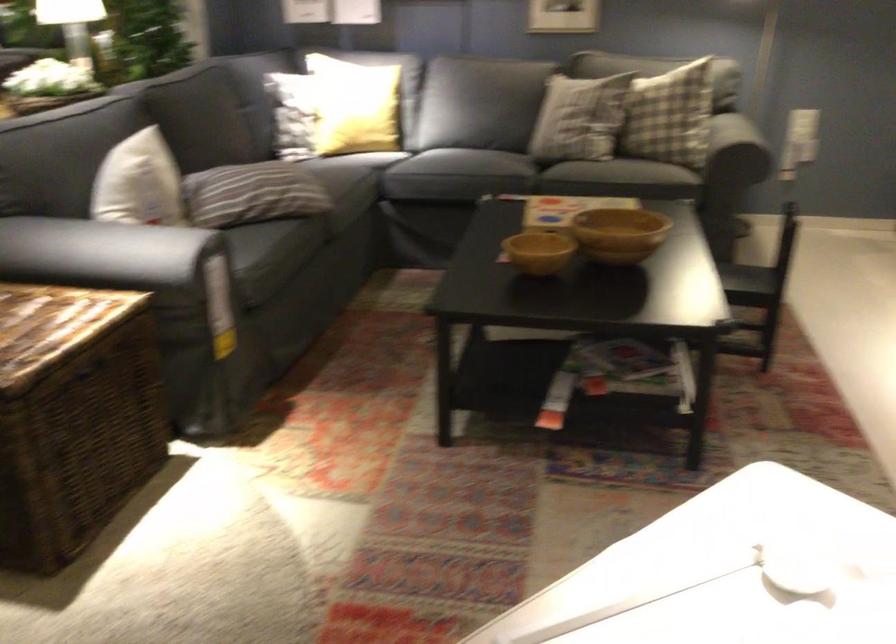
Describe the element at coordinates (386, 149) in the screenshot. The width and height of the screenshot is (896, 644). I see `a dark sofa sitting surface` at that location.